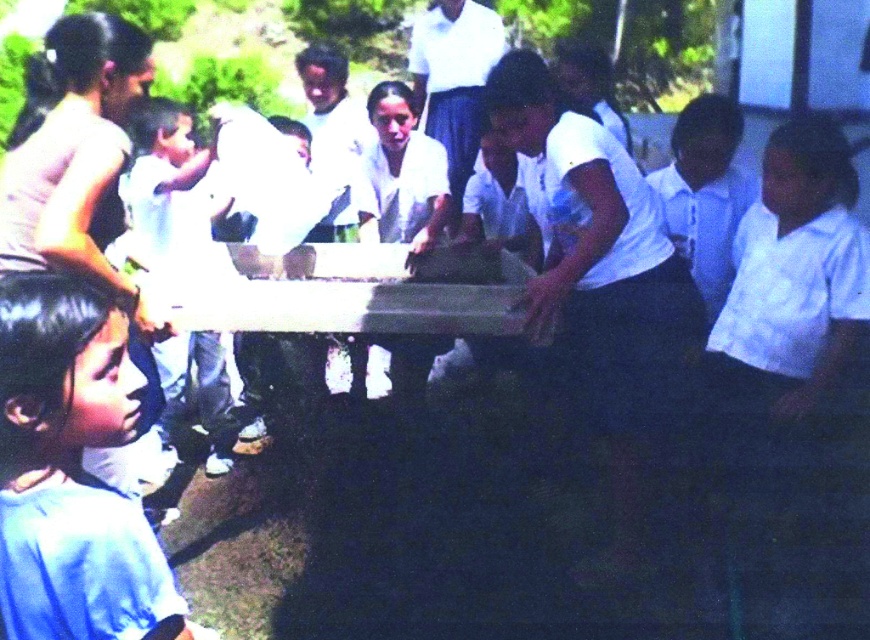
Question: Which point is closer to the camera?

Choices:
 (A) click(x=719, y=298)
 (B) click(x=754, y=264)
 (C) click(x=11, y=292)

Answer: (C)

Question: Which of the following is the farthest from the observer?

Choices:
 (A) blue fabric shirt at lower left
 (B) white cotton shirt at lower right

Answer: (B)

Question: Does blue fabric shirt at lower left appear over white cotton shirt at center?

Choices:
 (A) no
 (B) yes

Answer: (A)

Question: Does white cotton shirt at right appear on the right side of white cotton shirt at center?

Choices:
 (A) yes
 (B) no

Answer: (A)

Question: Does blue fabric shirt at lower left appear under white cotton shirt at center?

Choices:
 (A) yes
 (B) no

Answer: (A)

Question: Which point is farther to the camera?

Choices:
 (A) (523, 179)
 (B) (815, 282)
 (C) (32, 332)
 (D) (696, 237)

Answer: (D)